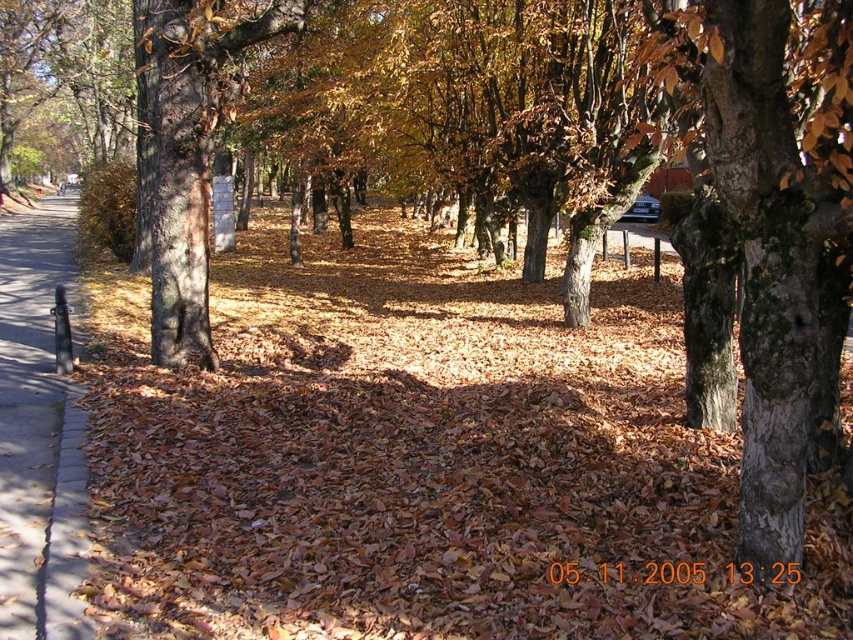
Is point (71, 232) more distant than point (163, 90)?

Yes, it is behind point (163, 90).

Where is `concrete sidewalk at left`? concrete sidewalk at left is located at coordinates (38, 432).